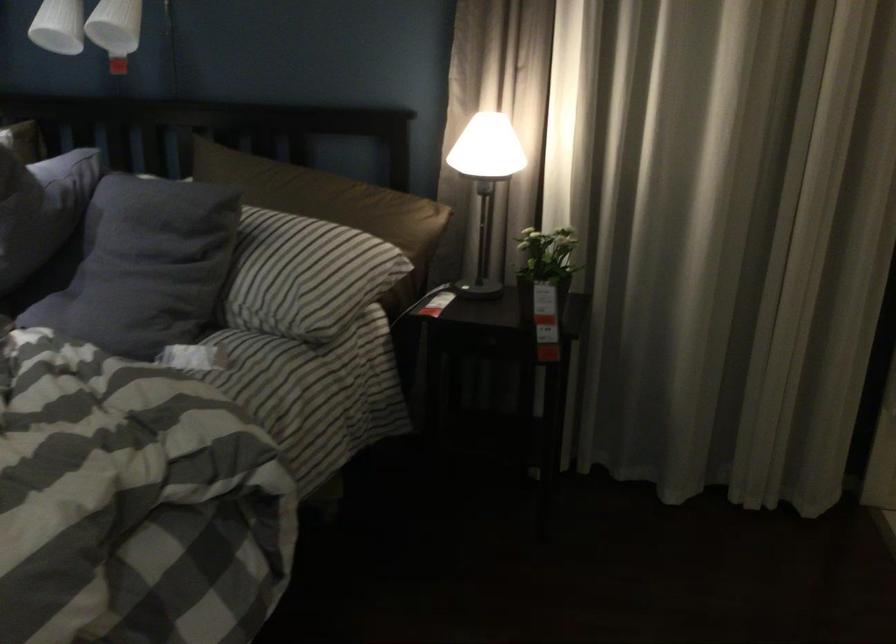
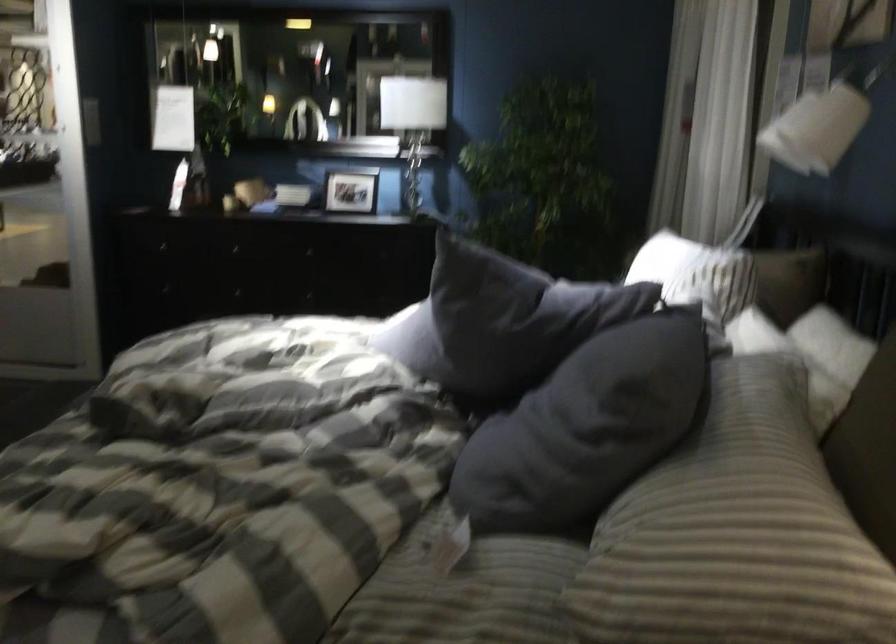
In the second image, find the point that corresponds to (x=289, y=223) in the first image.

(760, 453)